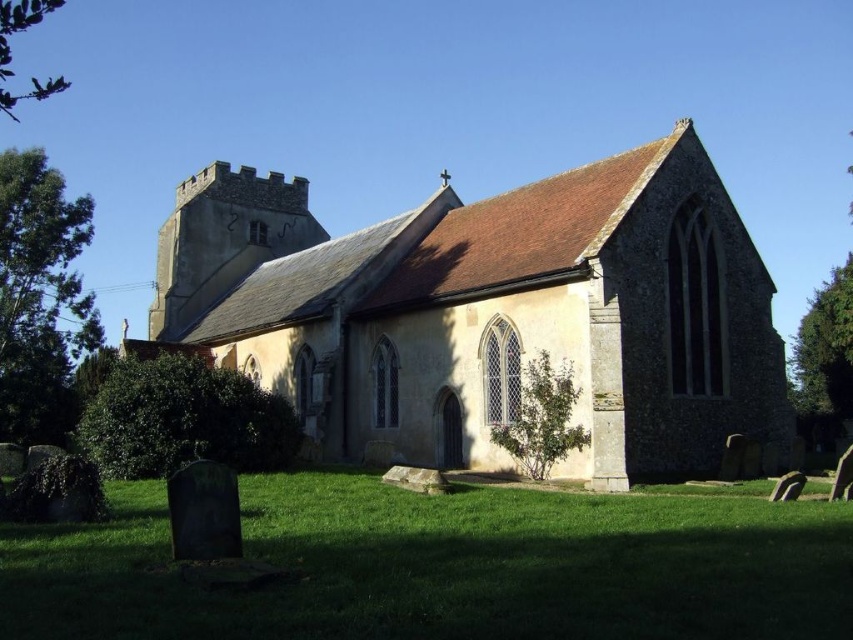
Question: Does brown stone church at center appear under green grass at lower center?

Choices:
 (A) no
 (B) yes

Answer: (A)

Question: Does brown stone church at center appear under green grass at lower center?

Choices:
 (A) yes
 (B) no

Answer: (B)

Question: Which point appears closest to the camera in this image?

Choices:
 (A) (521, 513)
 (B) (434, 422)

Answer: (A)

Question: Among these objects, which one is farthest from the camera?

Choices:
 (A) green grass at lower center
 (B) brown stone church at center

Answer: (B)

Question: Does brown stone church at center appear over green grass at lower center?

Choices:
 (A) yes
 (B) no

Answer: (A)